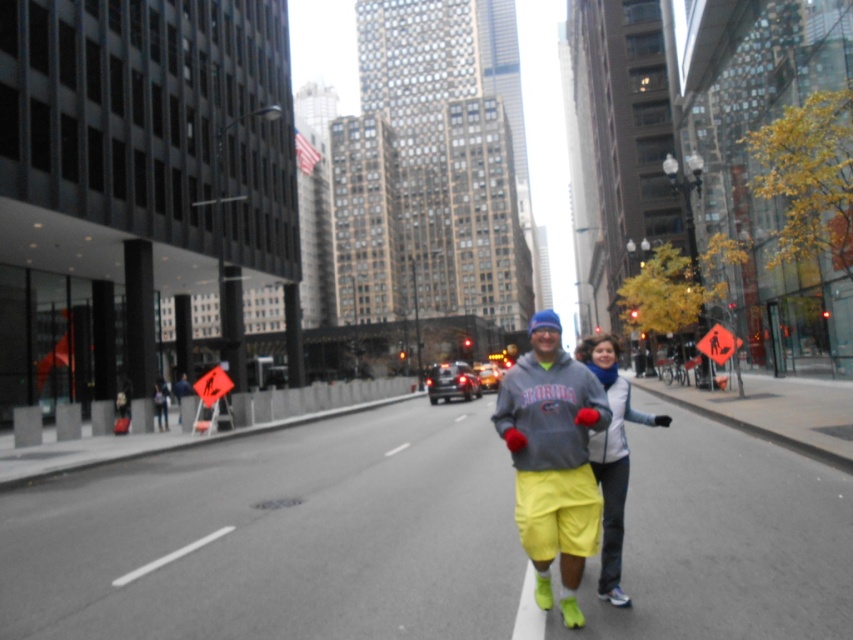
Question: Which object appears farthest from the camera in this image?

Choices:
 (A) yellow fabric pants at center
 (B) matte gray hoodie at center

Answer: (A)

Question: Considering the relative positions of matte gray hoodie at center and yellow fabric pants at center in the image provided, where is matte gray hoodie at center located with respect to yellow fabric pants at center?

Choices:
 (A) above
 (B) below

Answer: (A)

Question: Is matte gray hoodie at center bigger than yellow fabric pants at center?

Choices:
 (A) no
 (B) yes

Answer: (B)

Question: Which point is farther to the camera?

Choices:
 (A) matte gray hoodie at center
 (B) yellow fabric pants at center

Answer: (B)

Question: Observing the image, what is the correct spatial positioning of matte gray hoodie at center in reference to yellow fabric pants at center?

Choices:
 (A) right
 (B) left

Answer: (B)

Question: Among these objects, which one is farthest from the camera?

Choices:
 (A) matte gray hoodie at center
 (B) yellow fabric pants at center

Answer: (B)